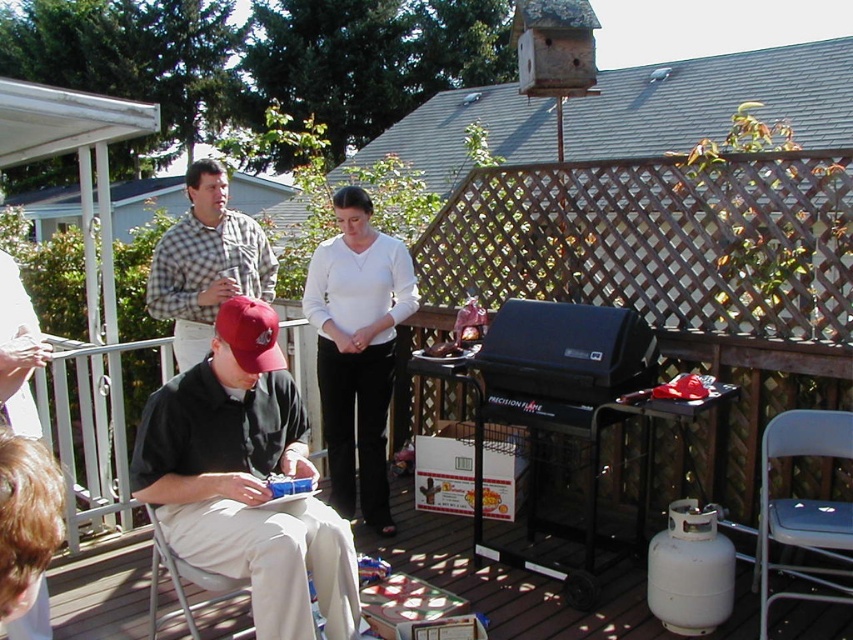
Question: Which point is farther from the camera taking this photo?

Choices:
 (A) (225, 292)
 (B) (416, 572)
 (C) (321, 362)

Answer: (C)

Question: Which object is farther from the camera taking this photo?

Choices:
 (A) white plastic chair at lower left
 (B) matte black shirt at center

Answer: (A)

Question: Which point is farther to the camera?

Choices:
 (A) (297, 572)
 (B) (367, 486)

Answer: (B)

Question: Is matte black shirt at center closer to camera compared to white smooth pants at center?

Choices:
 (A) no
 (B) yes

Answer: (B)

Question: Does white plastic chair at lower left appear on the right side of white smooth pants at center?

Choices:
 (A) yes
 (B) no

Answer: (A)

Question: Is the position of white smooth pants at center less distant than that of checkered fabric shirt at upper center?

Choices:
 (A) yes
 (B) no

Answer: (B)